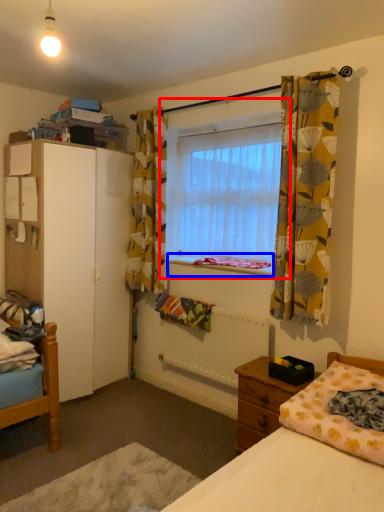
Question: Which object appears farthest to the camera in this image, window (highlighted by a red box) or window sill (highlighted by a blue box)?

Choices:
 (A) window
 (B) window sill

Answer: (B)